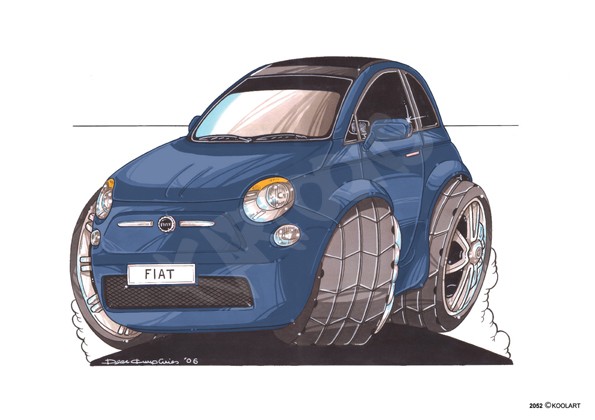
At what (x,y) coordinates should I click in order to perform the action: click on side lights. Please return your answer as a coordinate pair (x, y). This screenshot has width=595, height=420. Looking at the image, I should click on (293, 229), (90, 231).